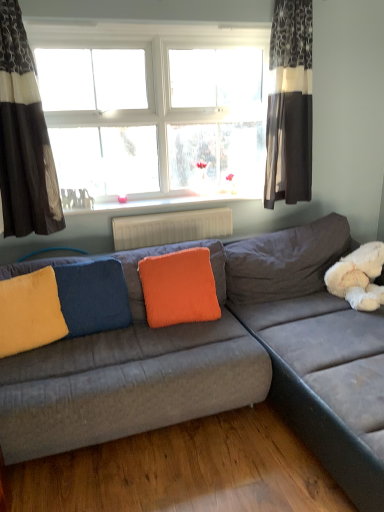
You are a GUI agent. You are given a task and a screenshot of the screen. Output one action in this format:
    pyautogui.click(x=<x>, y=<y>)
    Task: Click on the free point above white glossy radiator at upper center (from a real-world perspective)
    
    Given the screenshot: What is the action you would take?
    pyautogui.click(x=163, y=200)